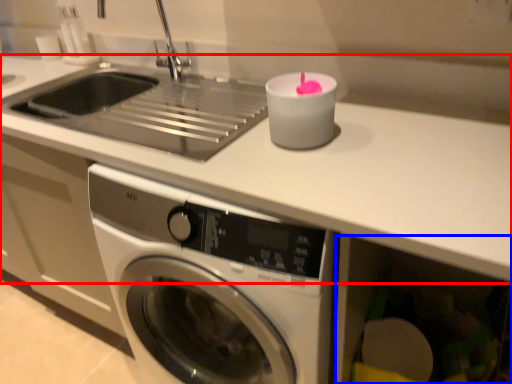
Question: Which point is closer to the camera, counter top (highlighted by a red box) or drawer (highlighted by a blue box)?

Choices:
 (A) counter top
 (B) drawer

Answer: (A)